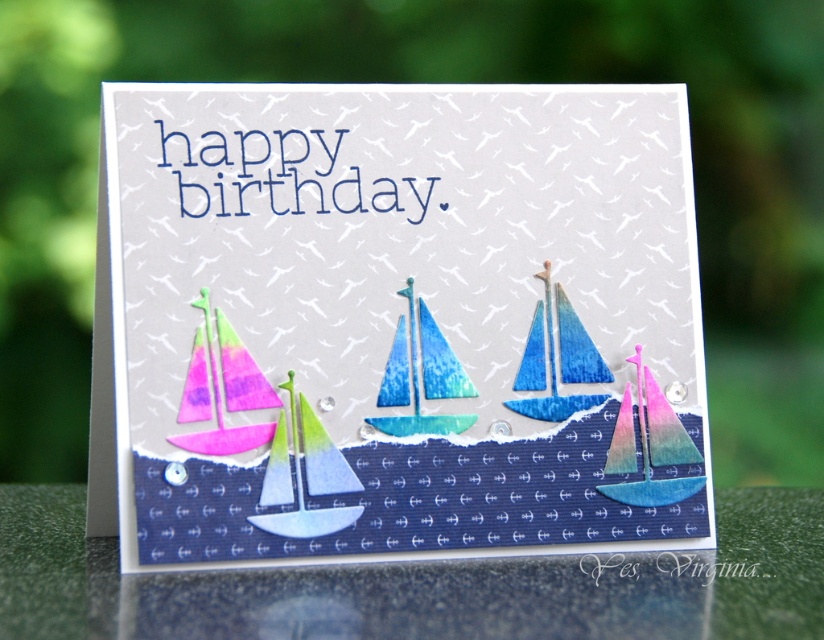
Based on the photo, you are designing a birthday card and want to ensure that the pink holographic sailboat at center is visible. Is the blue gradient paper sailboat at center blocking it?

The pink holographic sailboat at center is in front of the blue gradient paper sailboat at center, so it is not blocked and remains visible.

You are designing a birthday card and want to place a sticker between the watercolor sailboat at left and the pink holographic sailboat at center. Which sailboat should the sticker be closer to if you want it to be nearer to the smaller one?

The pink holographic sailboat at center is smaller than the watercolor sailboat at left, so the sticker should be placed closer to the pink holographic sailboat at center to be nearer to the smaller one.